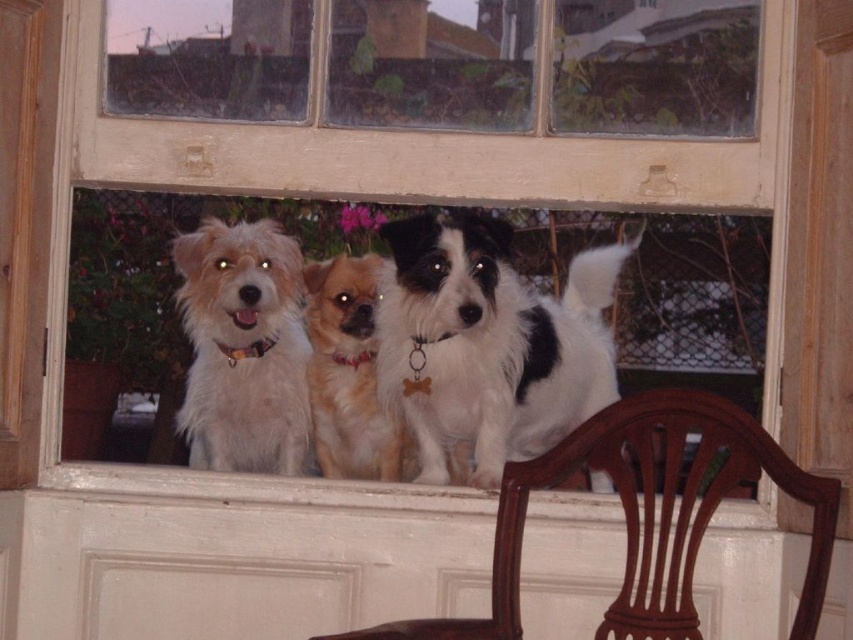
Question: Considering the real-world distances, which object is farthest from the transparent glass window at center?

Choices:
 (A) mahogany wood chair at lower center
 (B) golden brown fur at center
 (C) white fluffy dog at center

Answer: (A)

Question: Which object appears closest to the camera in this image?

Choices:
 (A) mahogany wood chair at lower center
 (B) white fluffy dog at center
 (C) golden brown fur at center

Answer: (A)

Question: Is mahogany wood chair at lower center closer to camera compared to white fluffy dog at center?

Choices:
 (A) yes
 (B) no

Answer: (A)

Question: Is white fluffy dog at center thinner than golden brown fur at center?

Choices:
 (A) yes
 (B) no

Answer: (B)

Question: Is transparent glass window at center below black and white fur at center?

Choices:
 (A) no
 (B) yes

Answer: (A)

Question: Which point is closer to the camera taking this photo?

Choices:
 (A) (631, 492)
 (B) (587, 262)
 (C) (251, 346)

Answer: (A)